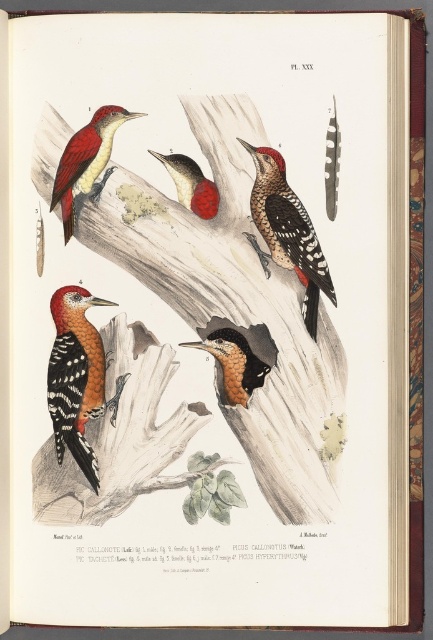
Question: Can you confirm if speckled orange woodpecker at center is positioned to the left of matte red woodpecker at upper left?

Choices:
 (A) yes
 (B) no

Answer: (A)

Question: Which object appears closest to the camera in this image?

Choices:
 (A) matte red woodpecker at upper left
 (B) speckled brown woodpecker at center

Answer: (A)

Question: Does speckled orange woodpecker at center appear on the right side of rustic brown woodpecker at center?

Choices:
 (A) no
 (B) yes

Answer: (A)

Question: Which object appears closest to the camera in this image?

Choices:
 (A) smooth red woodpecker at center
 (B) rustic brown woodpecker at center
 (C) matte red woodpecker at upper left
 (D) speckled brown woodpecker at center

Answer: (C)

Question: Which point is farther from the camera taking this photo?

Choices:
 (A) (57, 326)
 (B) (299, 220)
 (C) (200, 172)
 (D) (102, 136)

Answer: (B)

Question: Is speckled orange woodpecker at center wider than speckled brown woodpecker at center?

Choices:
 (A) no
 (B) yes

Answer: (A)